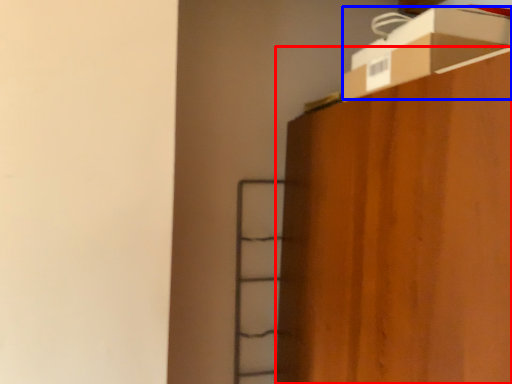
Question: Which object is closer to the camera taking this photo, furniture (highlighted by a red box) or cardboard box (highlighted by a blue box)?

Choices:
 (A) furniture
 (B) cardboard box

Answer: (A)